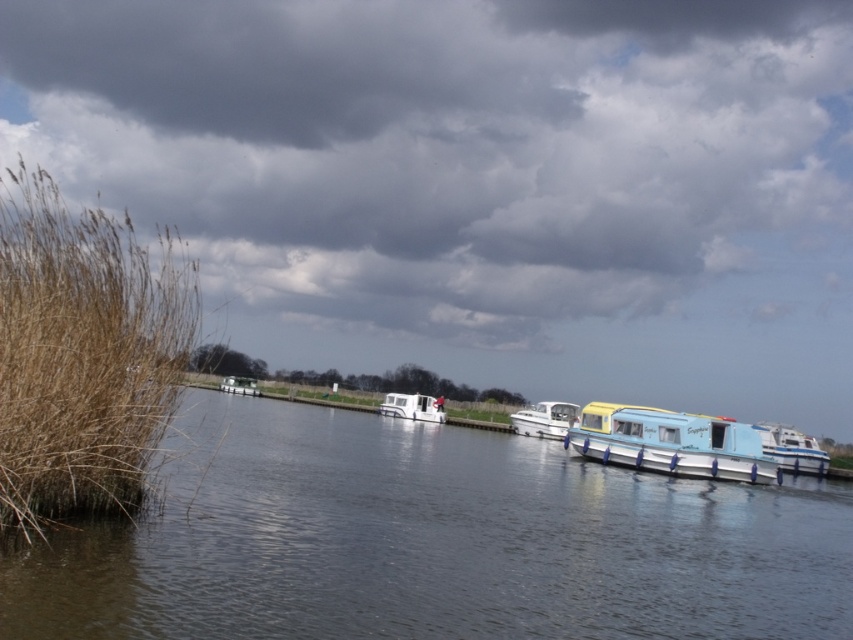
Does dry grass at left lie in front of white glossy boat at center?

Yes, it is in front of white glossy boat at center.

Locate an element on the screen. The height and width of the screenshot is (640, 853). dry grass at left is located at coordinates (84, 353).

Can you confirm if light blue plastic houseboat at center is thinner than white glossy motorboat at center?

In fact, light blue plastic houseboat at center might be wider than white glossy motorboat at center.

The width and height of the screenshot is (853, 640). I want to click on light blue plastic houseboat at center, so click(x=671, y=442).

Where is `light blue plastic houseboat at center`? This screenshot has width=853, height=640. light blue plastic houseboat at center is located at coordinates (671, 442).

Where is `light blue plastic houseboat at center`? This screenshot has width=853, height=640. light blue plastic houseboat at center is located at coordinates (671, 442).

Can you confirm if light blue plastic houseboat at center is smaller than white glossy boat at right?

Yes, light blue plastic houseboat at center is smaller than white glossy boat at right.

Where is `light blue plastic houseboat at center`? This screenshot has height=640, width=853. light blue plastic houseboat at center is located at coordinates (671, 442).

Where is `light blue plastic houseboat at center`? The image size is (853, 640). light blue plastic houseboat at center is located at coordinates (671, 442).